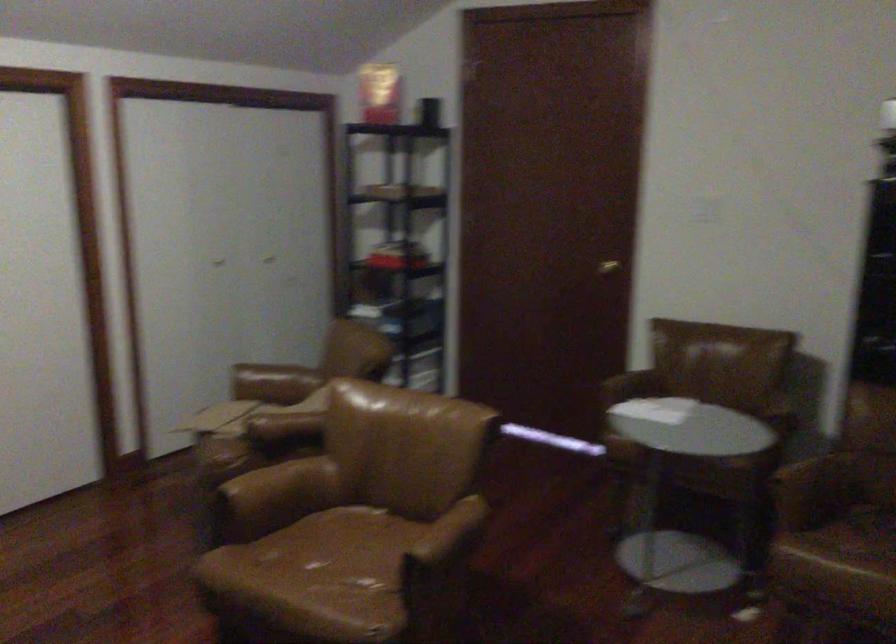
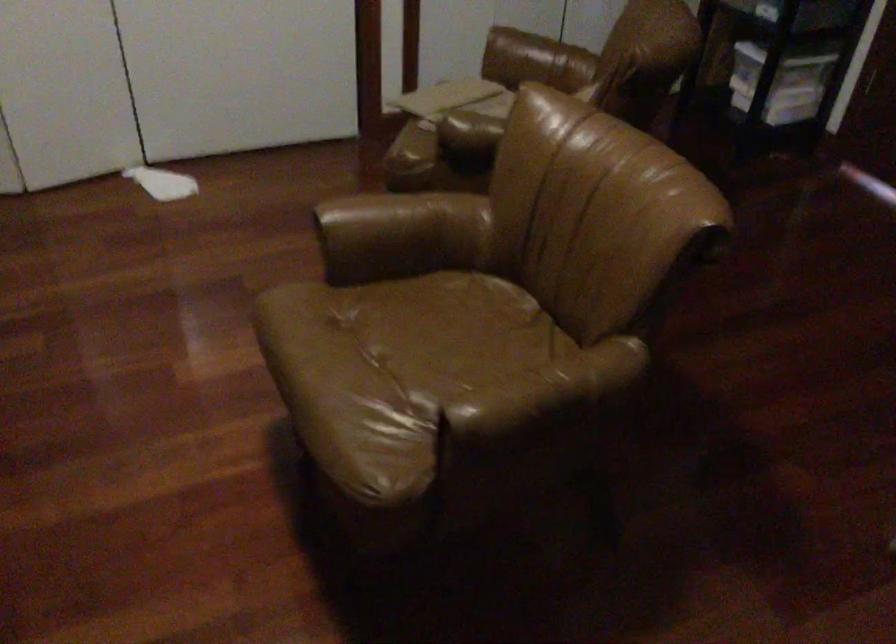
The images are taken continuously from a first-person perspective. In which direction is your viewpoint rotating?

The camera rotated toward left-down.